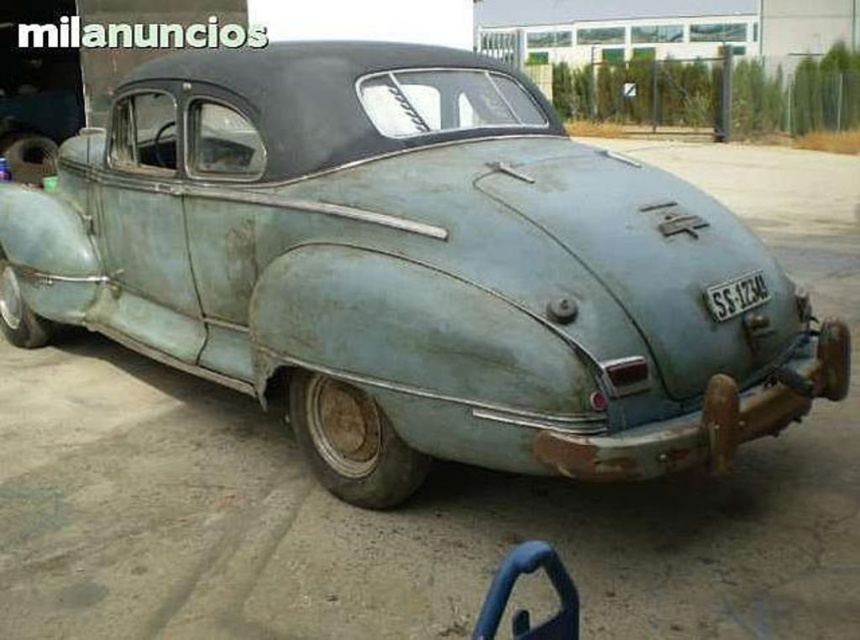
Describe the element at coordinates (410, 268) in the screenshot. Image resolution: width=860 pixels, height=640 pixels. I see `rusty metallic car at center` at that location.

Who is higher up, rusty metallic car at center or metallic gray license plate at center?

Positioned higher is rusty metallic car at center.

Locate an element on the screen. The width and height of the screenshot is (860, 640). rusty metallic car at center is located at coordinates (x=410, y=268).